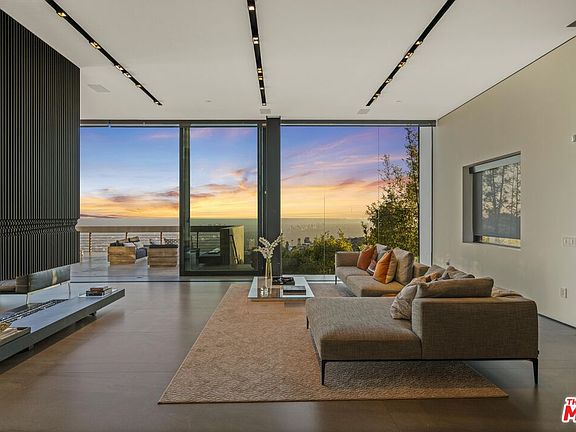
The height and width of the screenshot is (432, 576). In order to click on brown rug in this screenshot , I will do `click(245, 348)`.